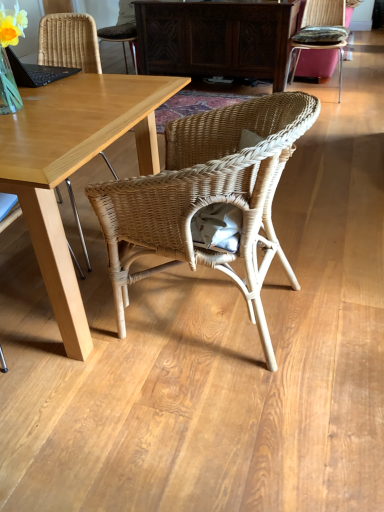
Identify the location of vacant area to the right of natural wicker chair at center, which is counted as the 3th chair, starting from the top. (329, 297).